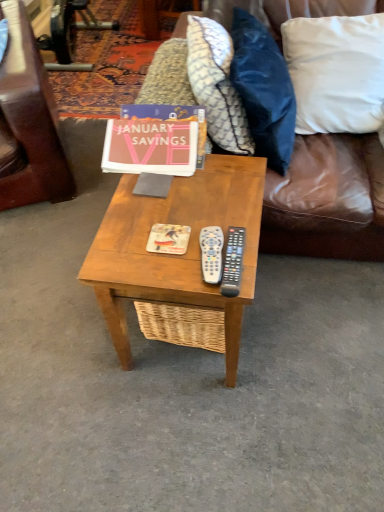
I want to click on free space that is to the left of matte orange magazine at center, so click(x=125, y=240).